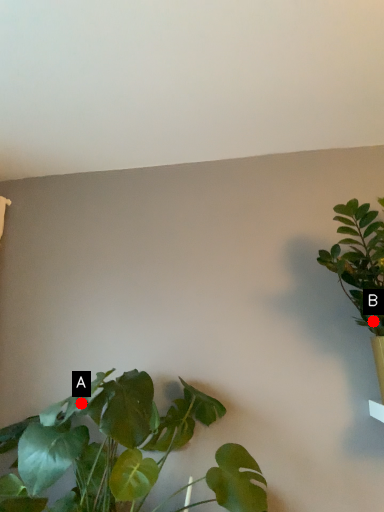
Question: Two points are circled on the image, labeled by A and B beside each circle. Which point is farther to the camera?

Choices:
 (A) A is further
 (B) B is further

Answer: (B)